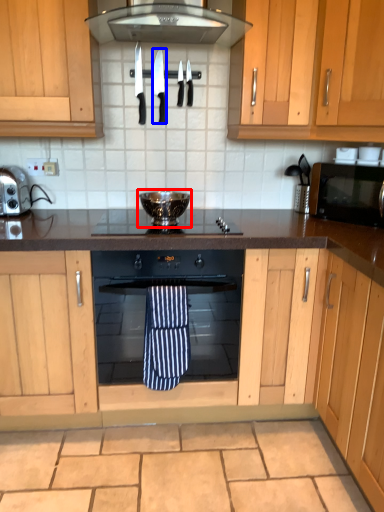
Question: Which of the following is the closest to the observer, appliance (highlighted by a red box) or knife (highlighted by a blue box)?

Choices:
 (A) appliance
 (B) knife

Answer: (A)